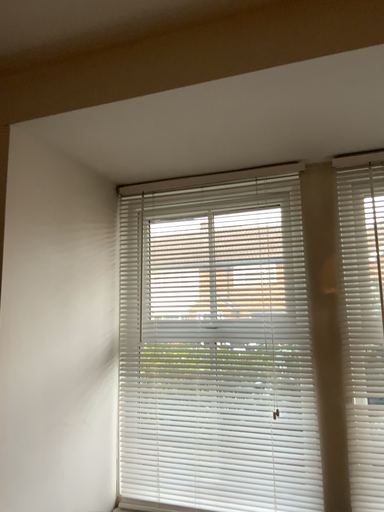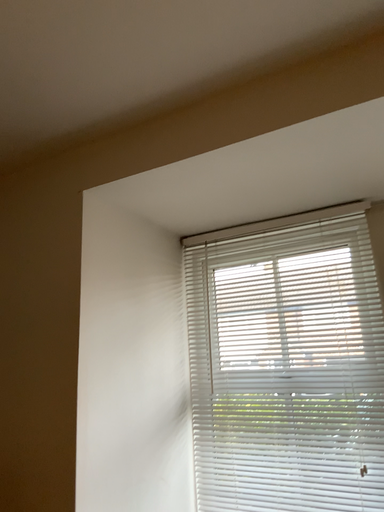
Question: How did the camera likely rotate when shooting the video?

Choices:
 (A) rotated right
 (B) rotated left

Answer: (B)